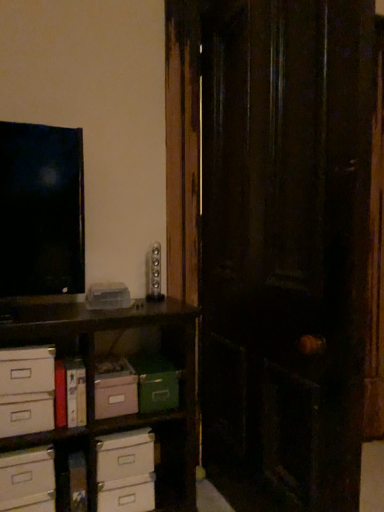
Question: From a real-world perspective, is green matte storage box at center, which appears as the first storage box when viewed from the right, physically below white cardboard drawer at lower left, the first drawer from the bottom?

Choices:
 (A) no
 (B) yes

Answer: (A)

Question: Is green matte storage box at center, which appears as the first storage box when viewed from the right, completely or partially outside of white cardboard drawer at lower left, the first drawer from the bottom?

Choices:
 (A) no
 (B) yes

Answer: (B)

Question: Is green matte storage box at center, the second storage box when ordered from left to right, shorter than white cardboard drawer at lower left, which ranks as the 3th drawer in top-to-bottom order?

Choices:
 (A) yes
 (B) no

Answer: (B)

Question: Considering the relative sizes of green matte storage box at center, which appears as the first storage box when viewed from the right, and white cardboard drawer at lower left, the first drawer from the bottom, in the image provided, is green matte storage box at center, which appears as the first storage box when viewed from the right, bigger than white cardboard drawer at lower left, the first drawer from the bottom,?

Choices:
 (A) no
 (B) yes

Answer: (B)

Question: Is green matte storage box at center, the second storage box when ordered from left to right, placed right next to white cardboard drawer at lower left, which ranks as the 3th drawer in top-to-bottom order?

Choices:
 (A) no
 (B) yes

Answer: (A)

Question: Looking at their shapes, would you say green matte storage box at center, the second storage box when ordered from left to right, is wider or thinner than hardcover book at lower left?

Choices:
 (A) thin
 (B) wide

Answer: (B)

Question: From the image's perspective, is green matte storage box at center, the second storage box when ordered from left to right, located above or below hardcover book at lower left?

Choices:
 (A) below
 (B) above

Answer: (A)

Question: Would you say green matte storage box at center, the second storage box when ordered from left to right, is to the left or to the right of hardcover book at lower left in the picture?

Choices:
 (A) right
 (B) left

Answer: (A)

Question: Considering the positions of green matte storage box at center, which appears as the first storage box when viewed from the right, and hardcover book at lower left in the image, is green matte storage box at center, which appears as the first storage box when viewed from the right, taller or shorter than hardcover book at lower left?

Choices:
 (A) short
 (B) tall

Answer: (A)

Question: Is white cardboard drawer at lower left, which is counted as the second drawer, starting from the bottom, spatially inside white cardboard drawer at lower left, which ranks as the 3th drawer in top-to-bottom order, or outside of it?

Choices:
 (A) outside
 (B) inside

Answer: (A)

Question: Is point (132, 459) positioned closer to the camera than point (4, 483)?

Choices:
 (A) closer
 (B) farther

Answer: (B)

Question: Considering the relative positions of white cardboard drawer at lower left, the second drawer positioned from the top, and white cardboard drawer at lower left, which ranks as the 3th drawer in top-to-bottom order, in the image provided, is white cardboard drawer at lower left, the second drawer positioned from the top, to the left or to the right of white cardboard drawer at lower left, which ranks as the 3th drawer in top-to-bottom order,?

Choices:
 (A) left
 (B) right

Answer: (B)

Question: From the image's perspective, is white cardboard drawer at lower left, which is counted as the second drawer, starting from the bottom, positioned above or below white cardboard drawer at lower left, which ranks as the 3th drawer in top-to-bottom order?

Choices:
 (A) above
 (B) below

Answer: (A)

Question: Is hardcover book at lower left taller or shorter than white cardboard drawer at lower left, which ranks as the 3th drawer in top-to-bottom order?

Choices:
 (A) tall
 (B) short

Answer: (A)

Question: From a real-world perspective, is hardcover book at lower left positioned above or below white cardboard drawer at lower left, the first drawer from the bottom?

Choices:
 (A) below
 (B) above

Answer: (B)